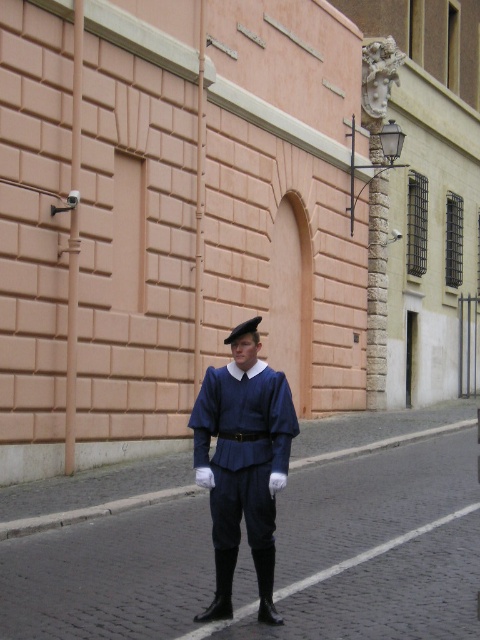
You are a tailor measuring a customer for a new uniform. You have the matte blue uniform at center and the black felt hat at center. Which item is wider?

The matte blue uniform at center is wider than the black felt hat at center according to the description.

You are a tailor measuring a customer for a new uniform. You have the matte blue uniform at center and the black felt hat at center. Which item is taller?

The matte blue uniform at center is much taller than the black felt hat at center.